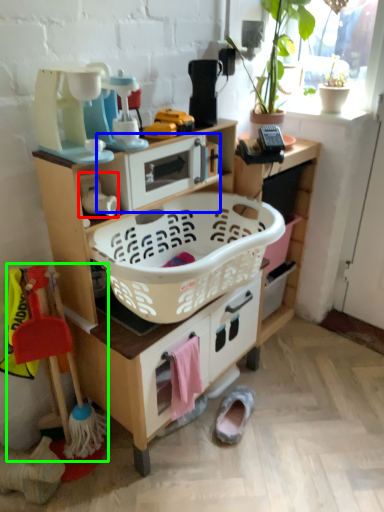
Question: Considering the real-world distances, which object is farthest from toy (highlighted by a red box)? appliance (highlighted by a blue box) or toy (highlighted by a green box)?

Choices:
 (A) appliance
 (B) toy

Answer: (B)